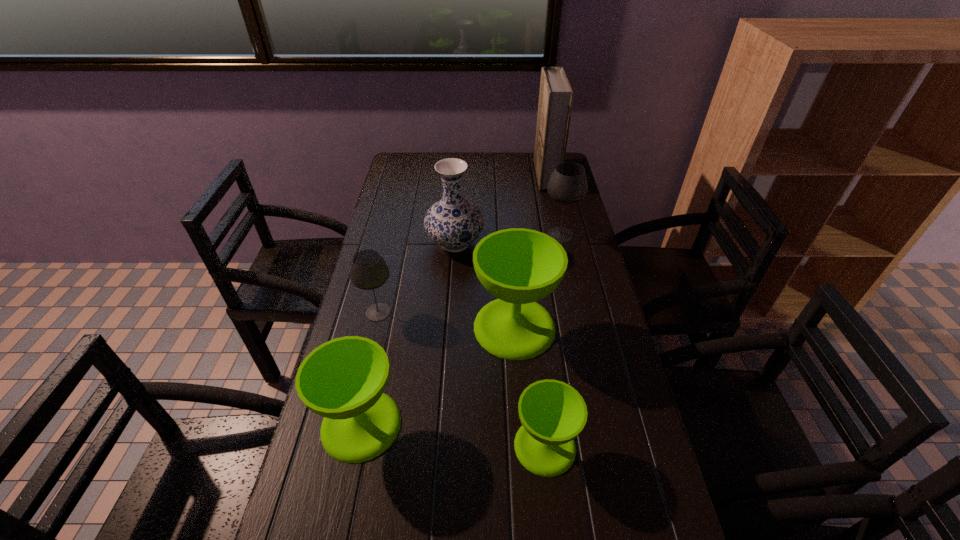
At what (x,y) coordinates should I click in order to perform the action: click on the smallest green wineglass. Please return your answer as a coordinate pair (x, y). Looking at the image, I should click on (552, 413).

The image size is (960, 540). Identify the location of vacant space located on the cover of the farthest object. (485, 175).

The height and width of the screenshot is (540, 960). I want to click on vacant area situated 0.180m on the cover of the farthest object, so click(x=492, y=175).

You are a GUI agent. You are given a task and a screenshot of the screen. Output one action in this format:
    pyautogui.click(x=<x>, y=<y>)
    Task: Click on the vacant space situated 0.250m on the cover of the farthest object
    
    Given the screenshot: What is the action you would take?
    pyautogui.click(x=475, y=175)

Where is `vacant position located on the back of the blue vase`? This screenshot has height=540, width=960. vacant position located on the back of the blue vase is located at coordinates (457, 218).

Identify the location of free space located 0.330m on the left of the farthest wineglass. (446, 235).

Locate an element on the screen. The height and width of the screenshot is (540, 960). free region located 0.250m on the back of the farthest green wineglass is located at coordinates (509, 245).

Locate an element on the screen. The width and height of the screenshot is (960, 540). free space located on the back of the leftmost green wineglass is located at coordinates (392, 280).

Image resolution: width=960 pixels, height=540 pixels. Identify the location of free space located on the front of the smaller gray wineglass. (368, 358).

You are a GUI agent. You are given a task and a screenshot of the screen. Output one action in this format:
    pyautogui.click(x=<x>, y=<y>)
    Task: Click on the vacant space located on the back of the smallest green wineglass
    The image size is (960, 540).
    Given the screenshot: What is the action you would take?
    pyautogui.click(x=528, y=298)